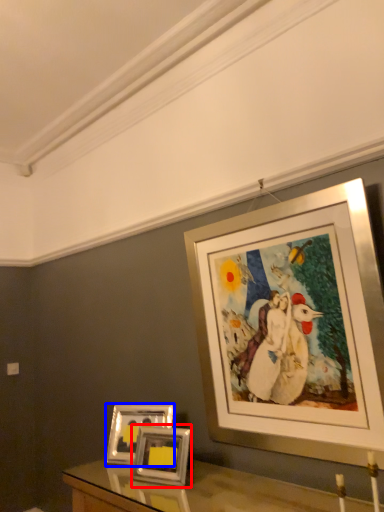
Question: Among these objects, which one is farthest to the camera, picture frame (highlighted by a red box) or picture frame (highlighted by a blue box)?

Choices:
 (A) picture frame
 (B) picture frame

Answer: (B)